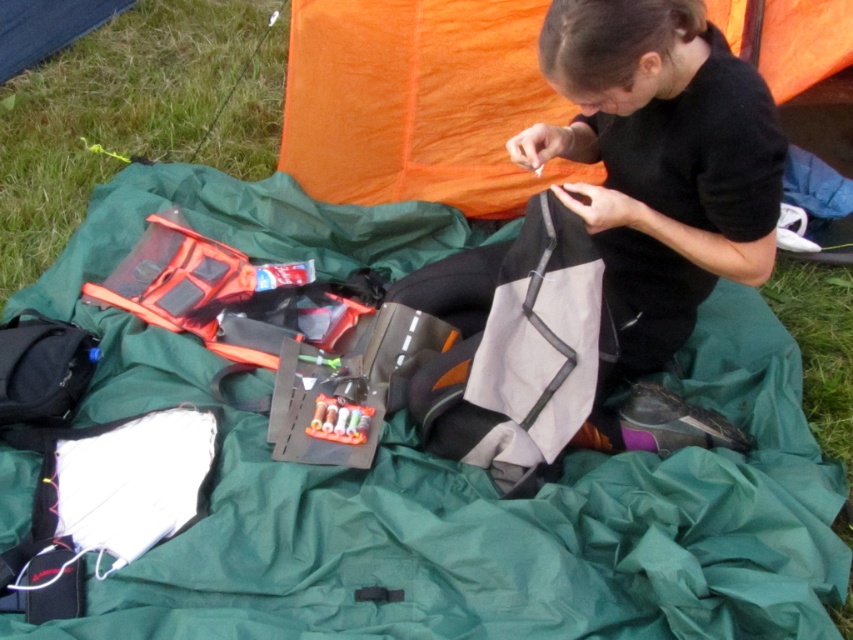
You are a hiker who needs to access the black matte fabric bag at center. You are currently standing behind the green fabric blanket at center. Can you reach the bag without moving the blanket?

The green fabric blanket at center is further to the viewer than the black matte fabric bag at center, so the blanket is blocking your path. You will need to move the green fabric blanket at center to access the bag.

You are standing in front of the outdoor crafting setup. There are two points marked in the scene. Which point, point (292,554) or point (445,291), is closer to you?

Point (292,554) is closer to you than point (445,291).

Consider the image. You are standing 1.6 meters away from the green fabric blanket at center. Can you reach it without moving your feet?

The green fabric blanket at center is 1.57 meters away from the viewer. Since you are standing 1.6 meters away, you are slightly farther than the distance to the blanket, so you might need to take a small step forward to reach it.